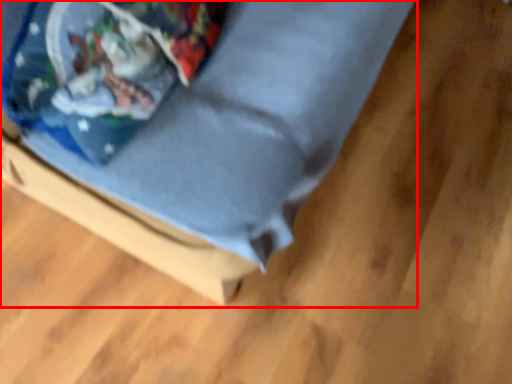
Question: From the image's perspective, where is furniture (annotated by the red box) located in relation to wrapping paper in the image?

Choices:
 (A) below
 (B) above

Answer: (B)